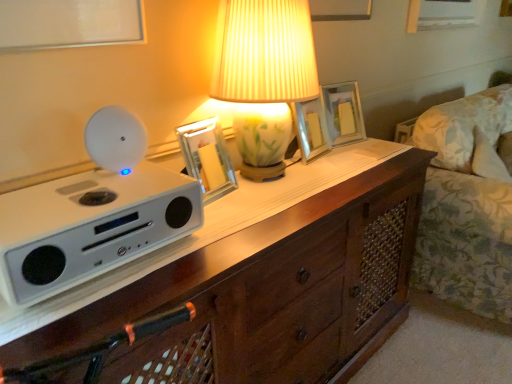
Locate an element on the screen. The image size is (512, 384). unoccupied area in front of porcelain floral lamp at center is located at coordinates (265, 212).